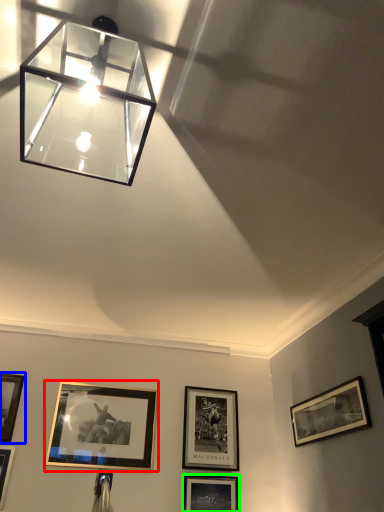
Question: Based on their relative distances, which object is farther from picture frame (highlighted by a red box)? Choose from picture frame (highlighted by a blue box) and picture frame (highlighted by a green box).

Choices:
 (A) picture frame
 (B) picture frame

Answer: (B)